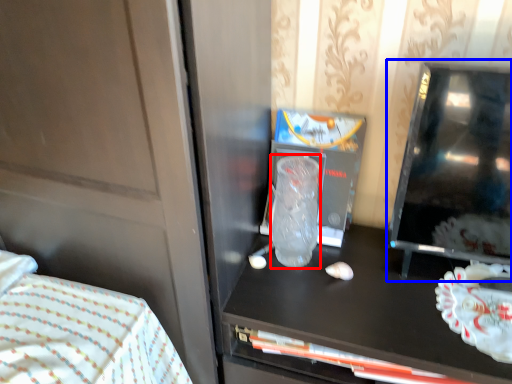
Question: Among these objects, which one is farthest to the camera, glass vase (highlighted by a red box) or appliance (highlighted by a blue box)?

Choices:
 (A) glass vase
 (B) appliance

Answer: (A)